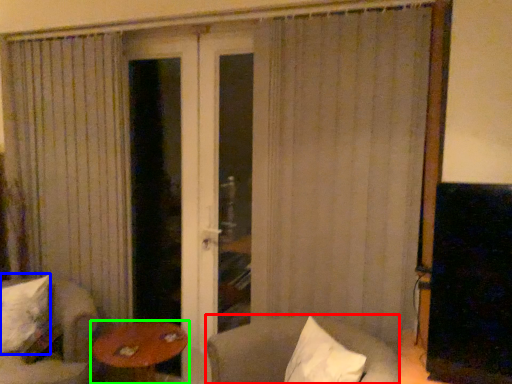
Question: Estimate the real-world distances between objects in this image. Which object is farther from chair (highlighted by a red box), pillow (highlighted by a blue box) or table (highlighted by a green box)?

Choices:
 (A) pillow
 (B) table

Answer: (A)